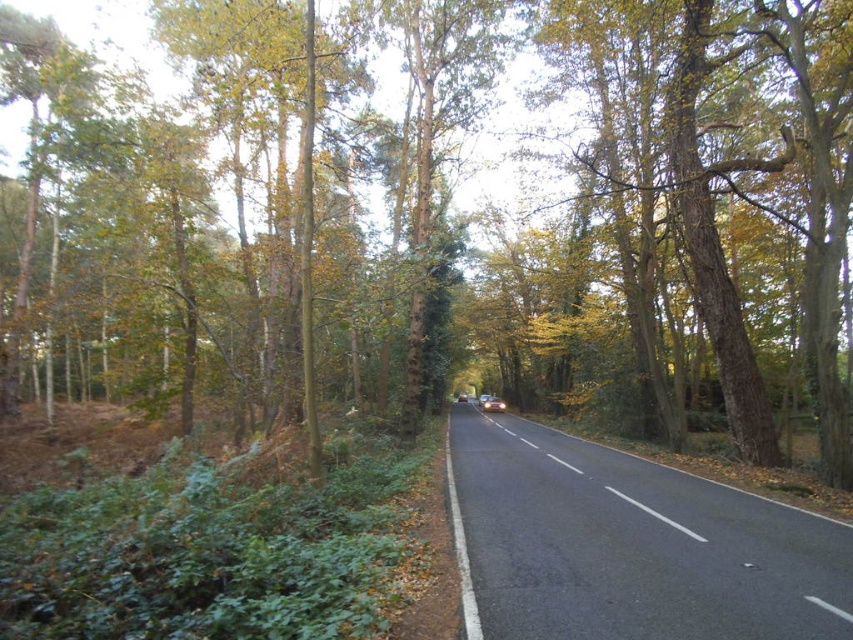
Question: Is black asphalt road at center closer to camera compared to metallic silver car at center?

Choices:
 (A) no
 (B) yes

Answer: (B)

Question: Does black asphalt road at center appear under metallic silver car at center?

Choices:
 (A) no
 (B) yes

Answer: (A)

Question: Is black asphalt road at center thinner than metallic silver car at center?

Choices:
 (A) no
 (B) yes

Answer: (A)

Question: Which object appears closest to the camera in this image?

Choices:
 (A) metallic silver car at center
 (B) black asphalt road at center

Answer: (B)

Question: Among these points, which one is farthest from the camera?

Choices:
 (A) (770, 611)
 (B) (494, 406)

Answer: (B)